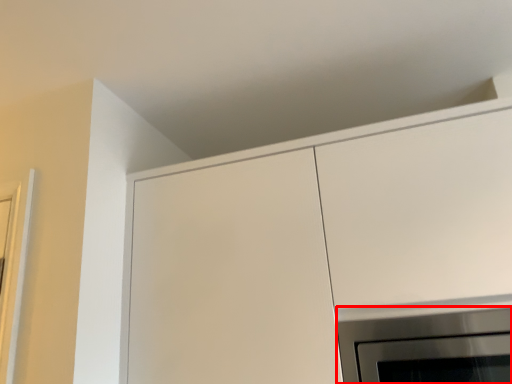
Question: From the image's perspective, what is the correct spatial positioning of appliance (annotated by the red box) in reference to cabinetry?

Choices:
 (A) above
 (B) below

Answer: (B)